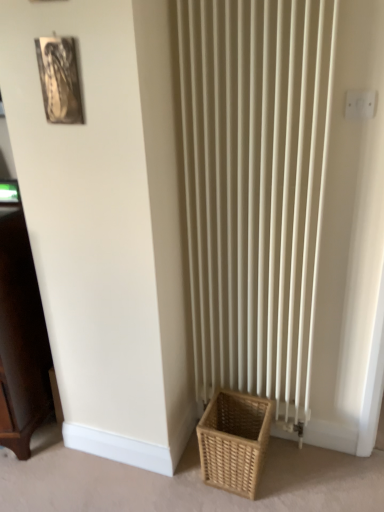
Question: Does natural woven basket at lower right have a larger size compared to white plastic electric outlet at upper right?

Choices:
 (A) no
 (B) yes

Answer: (B)

Question: Would you say natural woven basket at lower right contains white plastic electric outlet at upper right?

Choices:
 (A) yes
 (B) no

Answer: (B)

Question: Is natural woven basket at lower right at the left side of white plastic electric outlet at upper right?

Choices:
 (A) no
 (B) yes

Answer: (B)

Question: Is natural woven basket at lower right closer to the viewer compared to white plastic electric outlet at upper right?

Choices:
 (A) no
 (B) yes

Answer: (A)

Question: From the image's perspective, is natural woven basket at lower right beneath white plastic electric outlet at upper right?

Choices:
 (A) no
 (B) yes

Answer: (B)

Question: From a real-world perspective, is dark wood cabinet at left positioned above or below metallic silver picture frame at upper left?

Choices:
 (A) below
 (B) above

Answer: (A)

Question: Looking at the image, does dark wood cabinet at left seem bigger or smaller compared to metallic silver picture frame at upper left?

Choices:
 (A) big
 (B) small

Answer: (A)

Question: Considering their positions, is dark wood cabinet at left located in front of or behind metallic silver picture frame at upper left?

Choices:
 (A) front
 (B) behind

Answer: (B)

Question: Is dark wood cabinet at left inside or outside of metallic silver picture frame at upper left?

Choices:
 (A) outside
 (B) inside

Answer: (A)

Question: Considering the relative positions of white plastic electric outlet at upper right and metallic silver picture frame at upper left in the image provided, is white plastic electric outlet at upper right to the left or to the right of metallic silver picture frame at upper left?

Choices:
 (A) right
 (B) left

Answer: (A)

Question: From a real-world perspective, is white plastic electric outlet at upper right physically located above or below metallic silver picture frame at upper left?

Choices:
 (A) below
 (B) above

Answer: (A)

Question: Considering the positions of white plastic electric outlet at upper right and metallic silver picture frame at upper left in the image, is white plastic electric outlet at upper right taller or shorter than metallic silver picture frame at upper left?

Choices:
 (A) tall
 (B) short

Answer: (B)

Question: In terms of size, does white plastic electric outlet at upper right appear bigger or smaller than metallic silver picture frame at upper left?

Choices:
 (A) small
 (B) big

Answer: (A)

Question: Choose the correct answer: Is natural woven basket at lower right inside dark wood cabinet at left or outside it?

Choices:
 (A) outside
 (B) inside

Answer: (A)

Question: Looking at the image, does natural woven basket at lower right seem bigger or smaller compared to dark wood cabinet at left?

Choices:
 (A) small
 (B) big

Answer: (A)